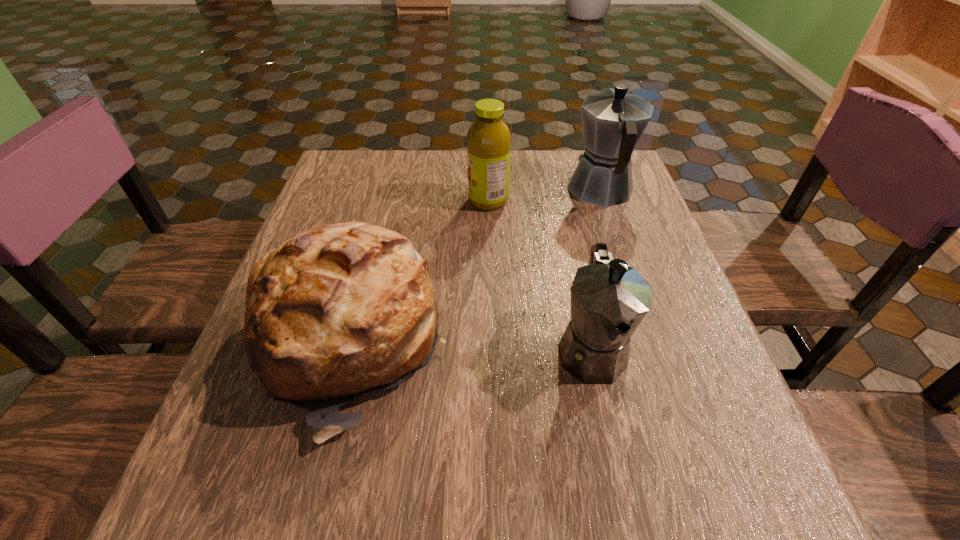
You are a GUI agent. You are given a task and a screenshot of the screen. Output one action in this format:
    pyautogui.click(x=<x>, y=<y>)
    Task: Click on the farther coffeepot
    This screenshot has width=960, height=540.
    Given the screenshot: What is the action you would take?
    pyautogui.click(x=613, y=121)

In order to click on the second object from left to right in this screenshot , I will do `click(489, 138)`.

The height and width of the screenshot is (540, 960). Find the location of `the shorter coffeepot`. the shorter coffeepot is located at coordinates (609, 299).

This screenshot has height=540, width=960. What are the coordinates of `the leftmost object` in the screenshot? It's located at (340, 310).

What are the coordinates of `free space located 0.270m on the front label of the third object from right to left` in the screenshot? It's located at (363, 200).

Where is `vacant point located on the front label of the third object from right to left`? The height and width of the screenshot is (540, 960). vacant point located on the front label of the third object from right to left is located at coordinates (317, 200).

Where is `vacant region located 0.300m on the front label of the third object from right to left`? The image size is (960, 540). vacant region located 0.300m on the front label of the third object from right to left is located at coordinates (351, 200).

Identify the location of vacant space located on the pouring side of the nearer coffeepot. (617, 473).

Locate an element on the screen. This screenshot has height=540, width=960. free space located on the back of the leftmost object is located at coordinates (382, 215).

Where is `coffeepot that is at the far edge`? This screenshot has height=540, width=960. coffeepot that is at the far edge is located at coordinates (613, 121).